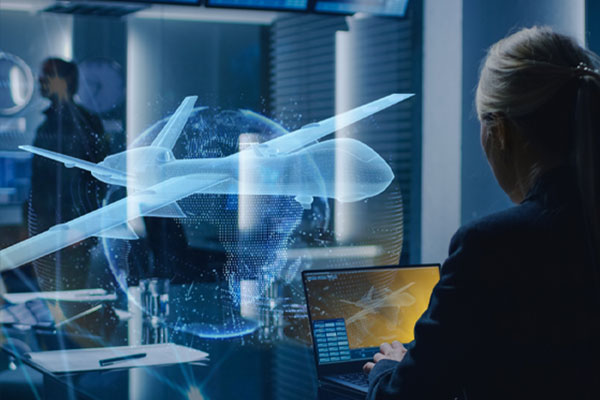
Image resolution: width=600 pixels, height=400 pixels. I want to click on pen, so click(126, 357).